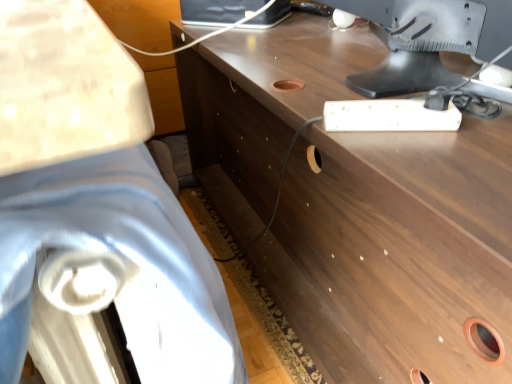
I want to click on blank space to the left of satin silver monitor at upper right, so tap(318, 46).